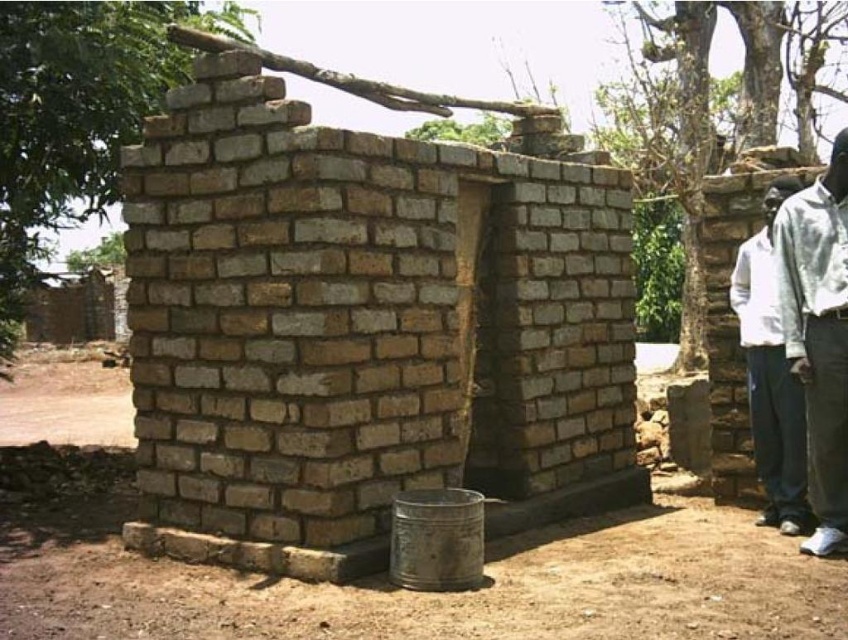
Question: Considering the real-world distances, which object is closest to the light gray shirt at right?

Choices:
 (A) brown rough brick wall at center
 (B) white cotton shirt at right

Answer: (B)

Question: Is light gray shirt at right to the left of white cotton shirt at right from the viewer's perspective?

Choices:
 (A) yes
 (B) no

Answer: (B)

Question: Estimate the real-world distances between objects in this image. Which object is closer to the light gray shirt at right?

Choices:
 (A) brown rough brick wall at center
 (B) white cotton shirt at right

Answer: (B)

Question: Can you confirm if brown rough brick wall at center is bigger than white cotton shirt at right?

Choices:
 (A) yes
 (B) no

Answer: (A)

Question: Can you confirm if brown rough brick wall at center is positioned to the left of white cotton shirt at right?

Choices:
 (A) no
 (B) yes

Answer: (B)

Question: Which is farther from the white cotton shirt at right?

Choices:
 (A) light gray shirt at right
 (B) brown rough brick wall at center

Answer: (B)